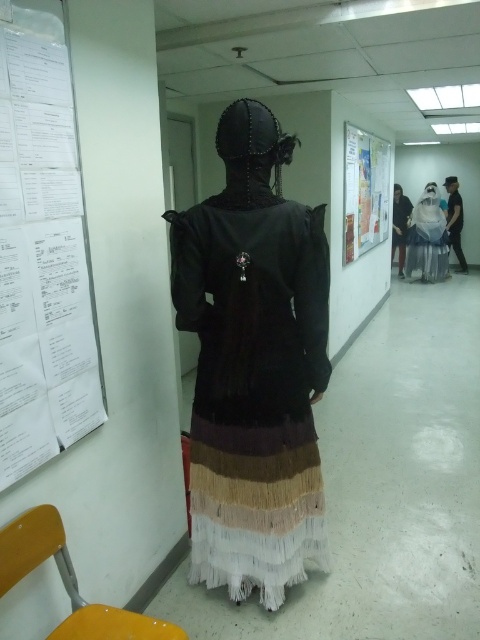
How distant is black leather dress at center from white paper poster at upper right?

A distance of 3.69 meters exists between black leather dress at center and white paper poster at upper right.

Is black leather dress at center below white paper poster at upper right?

Correct, black leather dress at center is located below white paper poster at upper right.

Does point (219, 419) come closer to viewer compared to point (360, 230)?

Yes, it is in front of point (360, 230).

Find the location of a particular element. black leather dress at center is located at coordinates (253, 364).

Who is more forward, (349, 138) or (392, 253)?

Point (349, 138)

Image resolution: width=480 pixels, height=640 pixels. I want to click on white paper poster at upper right, so click(364, 192).

Between point (355, 228) and point (396, 189), which one is positioned behind?

The point (396, 189) is more distant.

The height and width of the screenshot is (640, 480). I want to click on white paper poster at upper right, so click(x=364, y=192).

Is point (350, 257) positioned in front of point (456, 208)?

Yes, point (350, 257) is closer to viewer.

Who is more forward, (367, 243) or (457, 244)?

Point (367, 243) is more forward.

Locate an element on the screen. white paper poster at upper right is located at coordinates 364,192.